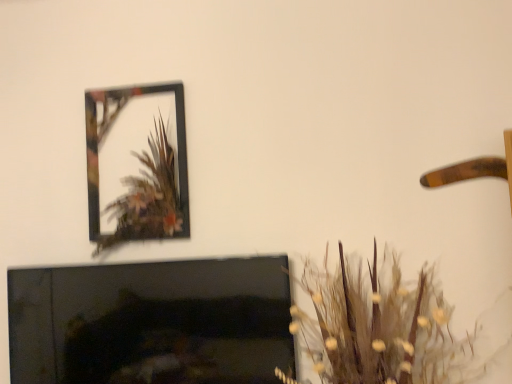
Question: Is brown textured plant at lower right taller than metallic frame at upper left?

Choices:
 (A) yes
 (B) no

Answer: (B)

Question: From a real-world perspective, is brown textured plant at lower right beneath metallic frame at upper left?

Choices:
 (A) no
 (B) yes

Answer: (B)

Question: Is metallic frame at upper left at the back of brown textured plant at lower right?

Choices:
 (A) no
 (B) yes

Answer: (A)

Question: Does brown textured plant at lower right have a lesser height compared to metallic frame at upper left?

Choices:
 (A) yes
 (B) no

Answer: (A)

Question: Does brown textured plant at lower right appear on the right side of metallic frame at upper left?

Choices:
 (A) no
 (B) yes

Answer: (B)

Question: Choose the correct answer: Is brown textured plant at lower right inside metallic frame at upper left or outside it?

Choices:
 (A) outside
 (B) inside

Answer: (A)

Question: From a real-world perspective, is brown textured plant at lower right physically located above or below metallic frame at upper left?

Choices:
 (A) below
 (B) above

Answer: (A)

Question: Does point (313, 332) appear closer or farther from the camera than point (181, 187)?

Choices:
 (A) farther
 (B) closer

Answer: (B)

Question: Considering their positions, is brown textured plant at lower right located in front of or behind metallic frame at upper left?

Choices:
 (A) front
 (B) behind

Answer: (A)

Question: In terms of width, does black glossy fireplace at lower left look wider or thinner when compared to metallic frame at upper left?

Choices:
 (A) thin
 (B) wide

Answer: (A)

Question: Would you say black glossy fireplace at lower left is inside or outside metallic frame at upper left?

Choices:
 (A) inside
 (B) outside

Answer: (B)

Question: Is black glossy fireplace at lower left to the left or to the right of metallic frame at upper left in the image?

Choices:
 (A) left
 (B) right

Answer: (B)

Question: Is point (41, 306) positioned closer to the camera than point (93, 225)?

Choices:
 (A) closer
 (B) farther

Answer: (A)

Question: Looking at their shapes, would you say metallic frame at upper left is wider or thinner than brown textured plant at lower right?

Choices:
 (A) thin
 (B) wide

Answer: (A)

Question: Considering the positions of point (182, 109) and point (339, 337), is point (182, 109) closer or farther from the camera than point (339, 337)?

Choices:
 (A) closer
 (B) farther

Answer: (B)